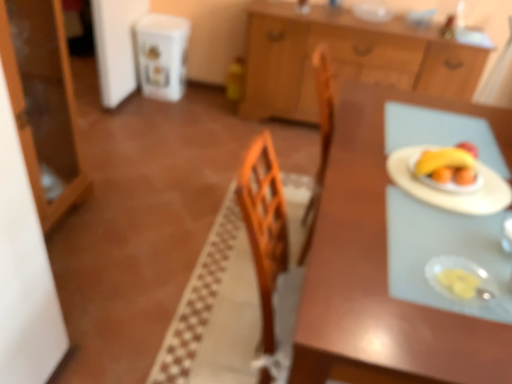
Identify the location of vacant region to the left of translucent plastic plate at right, the first tableware when ordered from left to right. This screenshot has height=384, width=512. (381, 274).